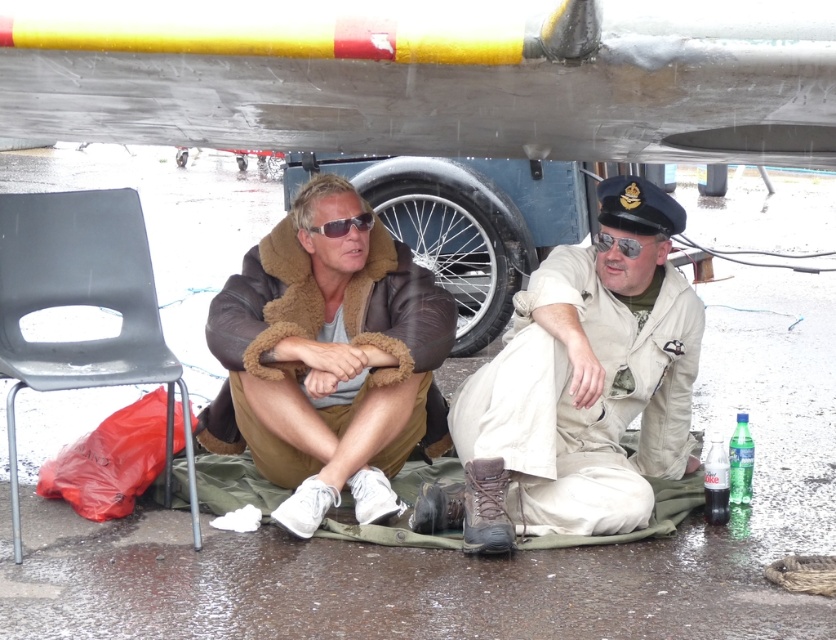
Between khaki fabric uniform at lower center and black plastic chair at lower left, which one appears on the right side from the viewer's perspective?

Positioned to the right is khaki fabric uniform at lower center.

Describe the element at coordinates (579, 387) in the screenshot. The image size is (836, 640). I see `khaki fabric uniform at lower center` at that location.

This screenshot has width=836, height=640. What are the coordinates of `khaki fabric uniform at lower center` in the screenshot? It's located at (579, 387).

Is metallic gray wing at upper center shorter than khaki fabric uniform at lower center?

Yes.

Is point (589, 157) less distant than point (615, 515)?

That is False.

Locate an element on the screen. The image size is (836, 640). metallic gray wing at upper center is located at coordinates click(437, 102).

I want to click on metallic gray wing at upper center, so click(x=437, y=102).

What do you see at coordinates (329, 360) in the screenshot? Image resolution: width=836 pixels, height=640 pixels. I see `brown shearling jacket at center` at bounding box center [329, 360].

Locate an element on the screen. brown shearling jacket at center is located at coordinates [x=329, y=360].